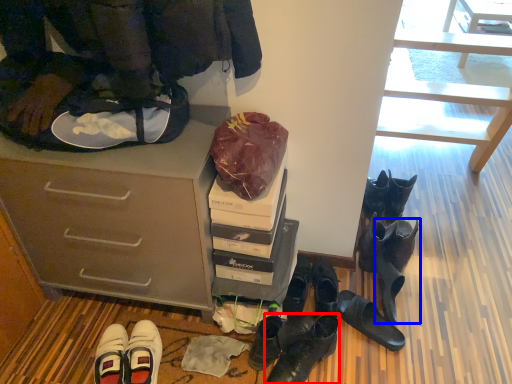
Question: Which object appears farthest to the camera in this image, footwear (highlighted by a red box) or footwear (highlighted by a blue box)?

Choices:
 (A) footwear
 (B) footwear

Answer: (B)